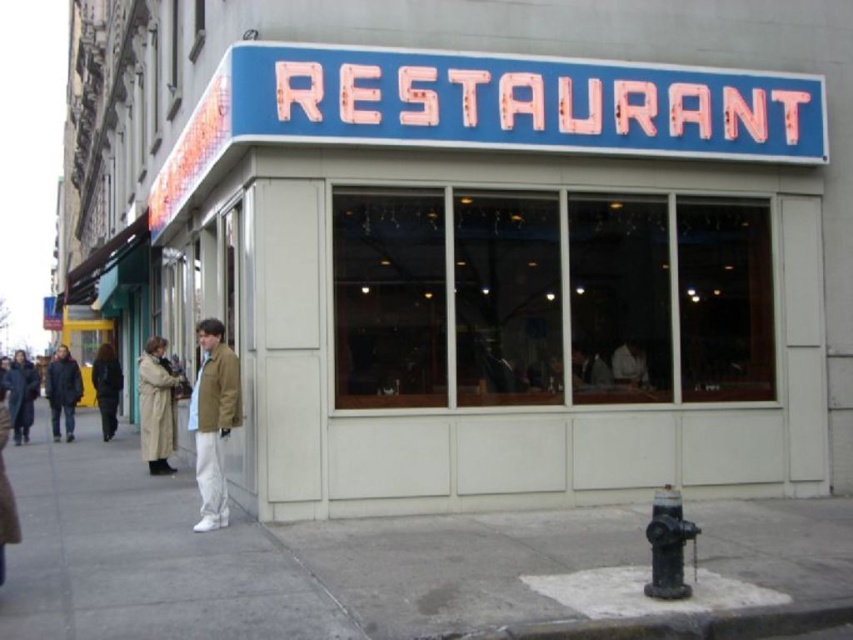
Is blue painted signboard at upper center bigger than black matte fire hydrant at lower right?

Yes, blue painted signboard at upper center is bigger than black matte fire hydrant at lower right.

Does blue painted signboard at upper center come in front of black matte fire hydrant at lower right?

No, blue painted signboard at upper center is behind black matte fire hydrant at lower right.

At what (x,y) coordinates should I click in order to perform the action: click on blue painted signboard at upper center. Please return your answer as a coordinate pair (x, y). Looking at the image, I should click on (514, 275).

Can you confirm if tan leather jacket at center is bigger than dark blue jacket at lower left?

Incorrect, tan leather jacket at center is not larger than dark blue jacket at lower left.

Is point (218, 470) positioned in front of point (67, 356)?

Yes, point (218, 470) is closer to viewer.

Locate an element on the screen. This screenshot has width=853, height=640. tan leather jacket at center is located at coordinates (213, 420).

Is gray concrete sidewalk at lower center closer to camera compared to blue neon sign at upper center?

Yes, it is.

Does gray concrete sidewalk at lower center appear over blue neon sign at upper center?

No, gray concrete sidewalk at lower center is not above blue neon sign at upper center.

Which is in front, point (511, 602) or point (672, 108)?

Point (511, 602)

The width and height of the screenshot is (853, 640). I want to click on gray concrete sidewalk at lower center, so click(x=270, y=560).